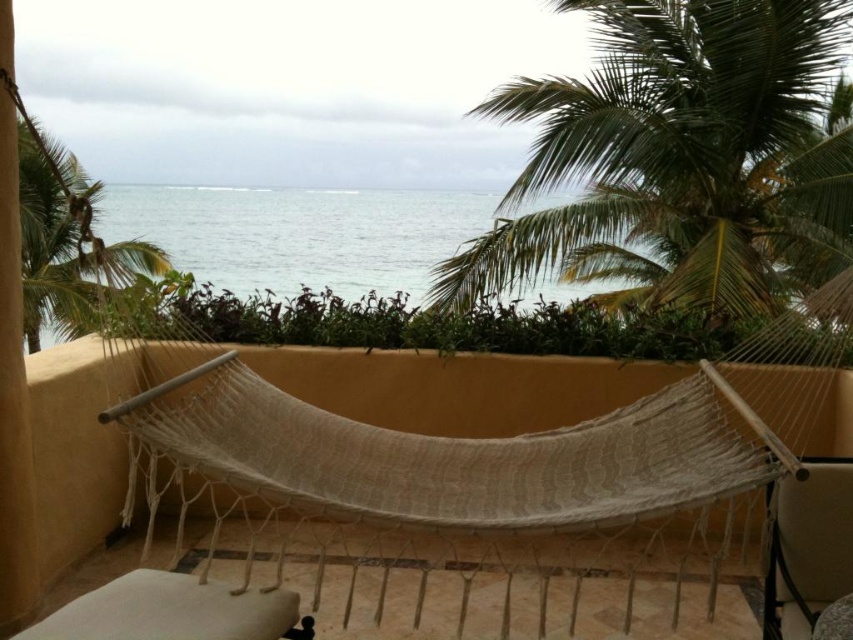
Question: Estimate the real-world distances between objects in this image. Which object is closer to the white fabric chair at lower right?

Choices:
 (A) blue water at center
 (B) green leafy palm tree at upper left
 (C) green leafy palm tree at upper right

Answer: (B)

Question: Which object is the farthest from the white fabric chair at lower right?

Choices:
 (A) blue water at center
 (B) green leafy palm tree at upper right
 (C) green leafy palm tree at upper left

Answer: (A)

Question: Which point is closer to the camera?

Choices:
 (A) (788, 492)
 (B) (202, 227)

Answer: (A)

Question: Is the position of green leafy palm tree at upper left more distant than that of white fabric chair at lower right?

Choices:
 (A) no
 (B) yes

Answer: (B)

Question: Can you confirm if blue water at center is smaller than white fabric chair at lower right?

Choices:
 (A) no
 (B) yes

Answer: (B)

Question: Can you confirm if green leafy palm tree at upper right is positioned above blue water at center?

Choices:
 (A) no
 (B) yes

Answer: (B)